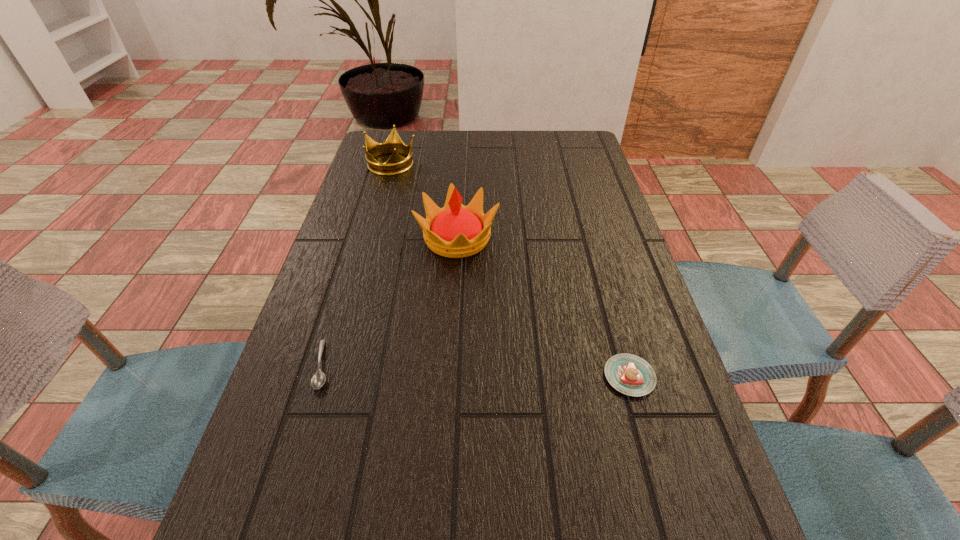
Locate an element on the screen. unoccupied position between the shortest object and the farthest object is located at coordinates (357, 264).

What are the coordinates of `vacant space in between the taller crown and the pastry` in the screenshot? It's located at (543, 307).

The image size is (960, 540). What are the coordinates of `vacant point located between the nearer crown and the soupspoon` in the screenshot? It's located at (390, 301).

Locate an element on the screen. Image resolution: width=960 pixels, height=540 pixels. vacant space in between the soupspoon and the tallest object is located at coordinates (390, 301).

Find the location of a particular element. The width and height of the screenshot is (960, 540). free point between the shorter crown and the rightmost object is located at coordinates (511, 270).

Where is `free point between the third object from left to right and the soupspoon`? This screenshot has width=960, height=540. free point between the third object from left to right and the soupspoon is located at coordinates (390, 301).

You are a GUI agent. You are given a task and a screenshot of the screen. Output one action in this format:
    pyautogui.click(x=<x>, y=<y>)
    Task: Click on the vacant region between the left crown and the pastry
    The image size is (960, 540).
    Given the screenshot: What is the action you would take?
    pyautogui.click(x=511, y=270)

Locate an element on the screen. free area in between the left crown and the second shortest object is located at coordinates (511, 270).

Find the location of a particular element. This screenshot has width=960, height=540. unoccupied area between the second shortest object and the shortest object is located at coordinates (476, 370).

Where is `unoccupied position between the left crown and the soupspoon`? unoccupied position between the left crown and the soupspoon is located at coordinates (357, 264).